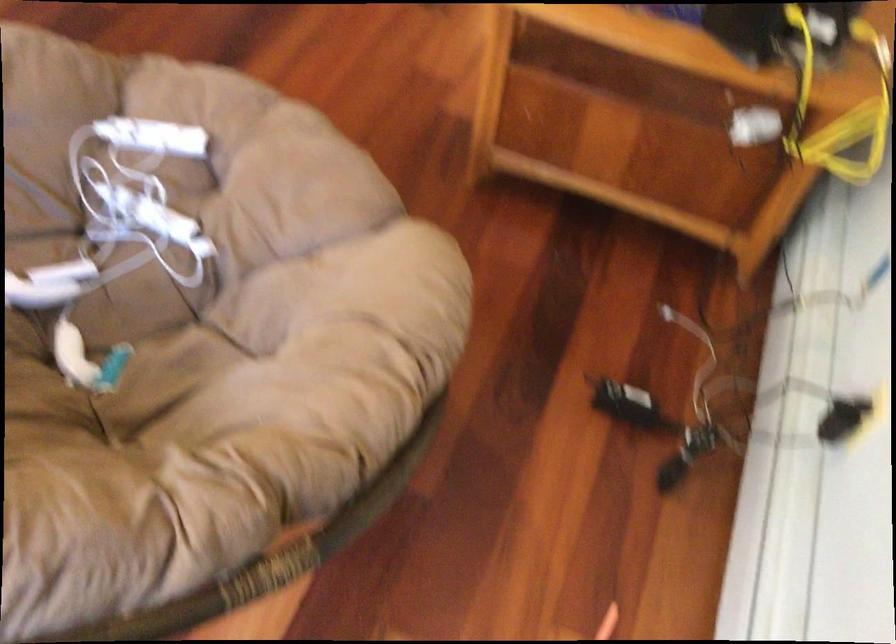
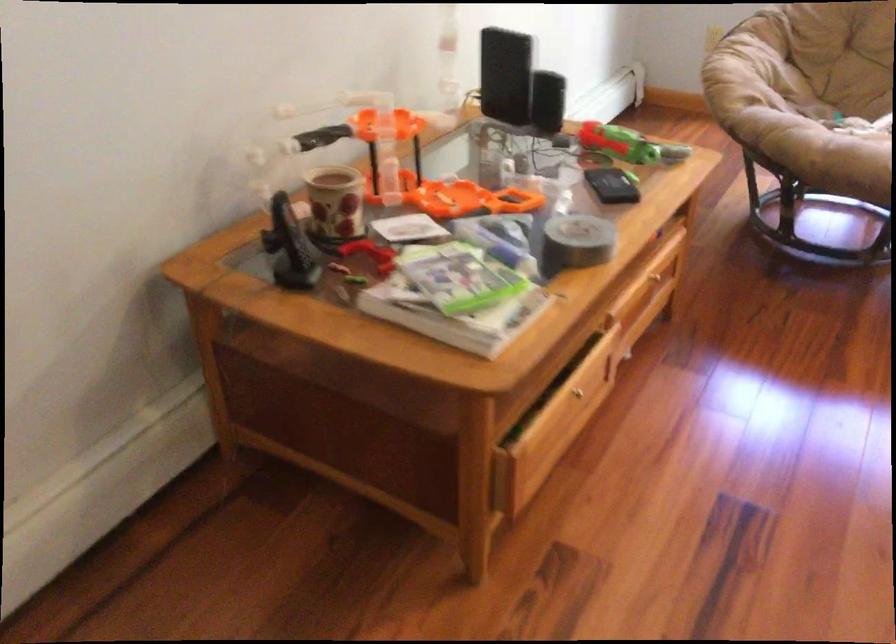
In the second image, find the point that corresponds to point 337,283 in the first image.

(745, 69)